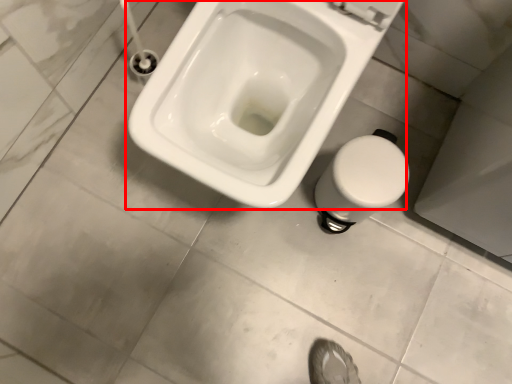
Question: From the image's perspective, what is the correct spatial relationship of toilet (annotated by the red box) in relation to bidet?

Choices:
 (A) below
 (B) above

Answer: (B)